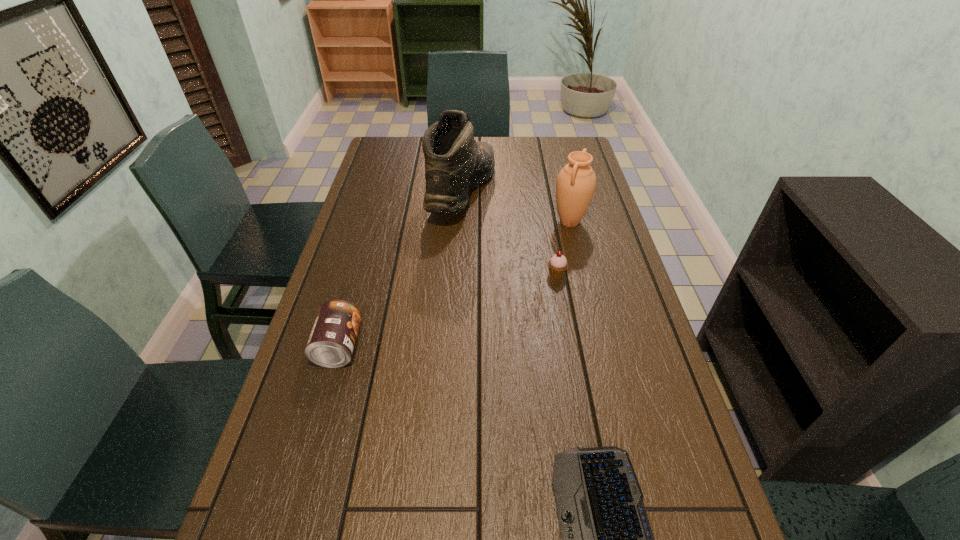
Where is `ski boot`? Image resolution: width=960 pixels, height=540 pixels. ski boot is located at coordinates (454, 162).

Find the location of a particular element. The width and height of the screenshot is (960, 540). the second object from left to right is located at coordinates (454, 162).

In order to click on the fourth shortest object in this screenshot , I will do `click(576, 182)`.

I want to click on can, so coord(332,339).

The height and width of the screenshot is (540, 960). In order to click on the third tallest object in this screenshot , I will do `click(332, 339)`.

In order to click on cupcake in this screenshot , I will do `click(557, 265)`.

Image resolution: width=960 pixels, height=540 pixels. Identify the location of the second shortest object. (557, 265).

Locate an element on the screen. Image resolution: width=960 pixels, height=540 pixels. free space located on the front of the tallest object is located at coordinates tap(459, 260).

You are a GUI agent. You are given a task and a screenshot of the screen. Output one action in this format:
    pyautogui.click(x=<x>, y=<y>)
    Task: Click on the free space located 0.060m on the back of the urn
    The width and height of the screenshot is (960, 540).
    Given the screenshot: What is the action you would take?
    pyautogui.click(x=564, y=201)

Locate an element on the screen. vacant region located on the front label of the third tallest object is located at coordinates (466, 346).